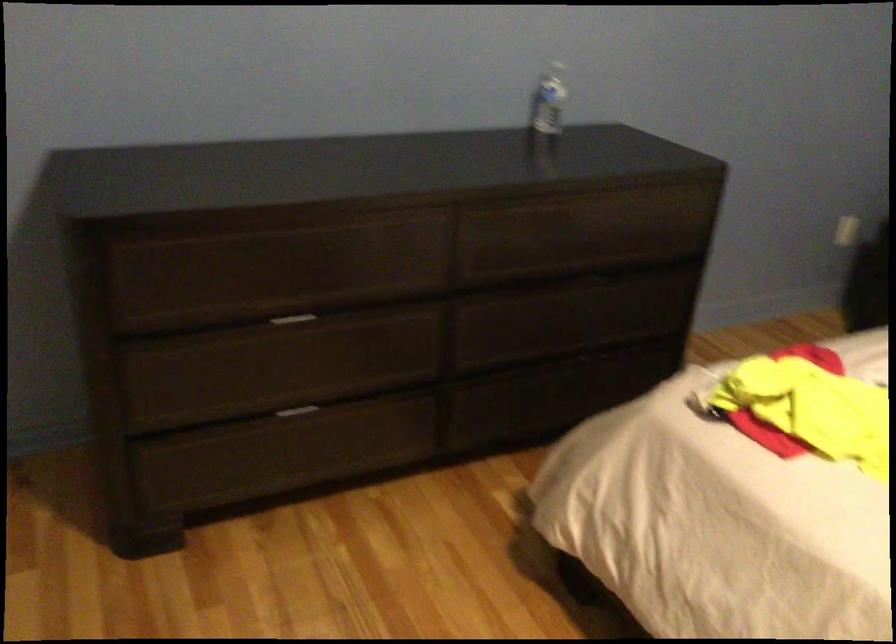
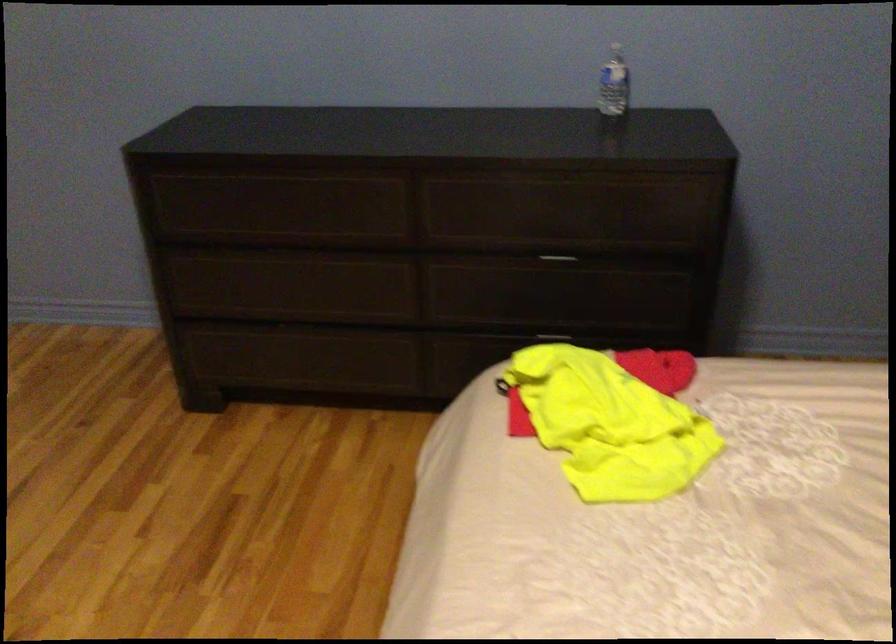
The point at (588, 278) is marked in the first image. Where is the corresponding point in the second image?

(557, 260)